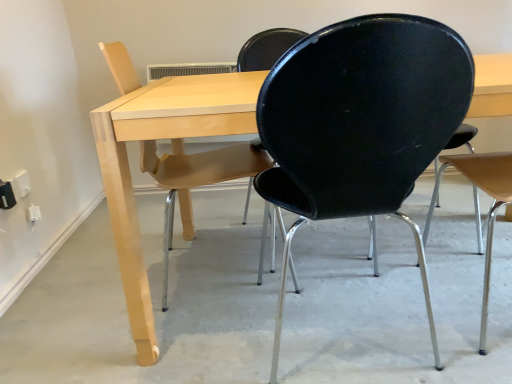
In order to click on unoccupied region to the right of matte wood chair at left, the 3th chair positioned from the right in this screenshot , I will do `click(294, 264)`.